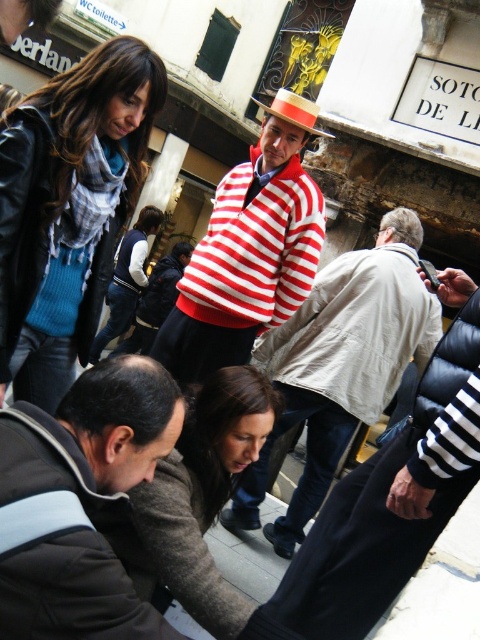
Question: Which point is farther to the camera?

Choices:
 (A) (325, 134)
 (B) (194, 324)
 (C) (140, 584)
 (D) (136, 285)

Answer: (D)

Question: Which point is farther from the camera taking this photo?

Choices:
 (A) (87, 492)
 (B) (107, 298)
 (C) (123, 157)

Answer: (B)

Question: In this image, where is striped sweater at center located relative to matte blue sweater at center?

Choices:
 (A) right
 (B) left

Answer: (A)

Question: Does dark brown wool sweater at center have a larger size compared to matte blue sweater at center?

Choices:
 (A) yes
 (B) no

Answer: (B)

Question: Which object appears closest to the camera in this image?

Choices:
 (A) blue knit sweater at upper left
 (B) dark brown wool sweater at center
 (C) striped sweater at center

Answer: (A)

Question: Can you confirm if striped cotton sweater at center is positioned below matte blue sweater at center?

Choices:
 (A) no
 (B) yes

Answer: (A)